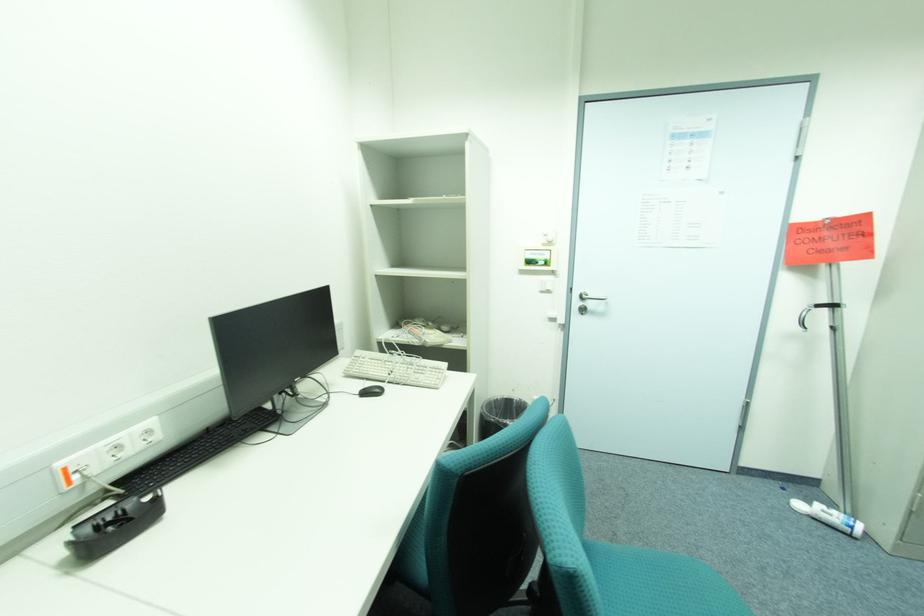
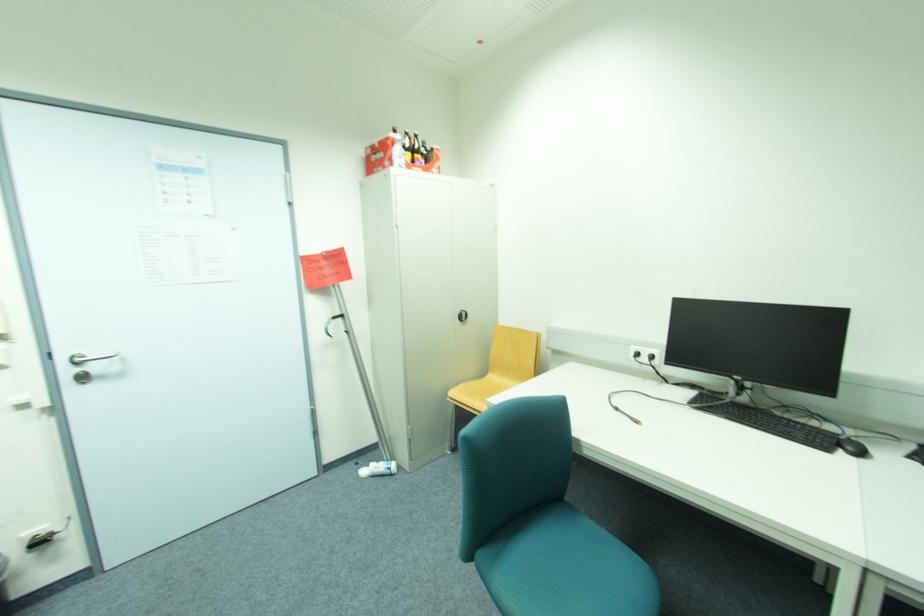
The point at (824,306) is marked in the first image. Where is the corresponding point in the second image?

(339, 317)